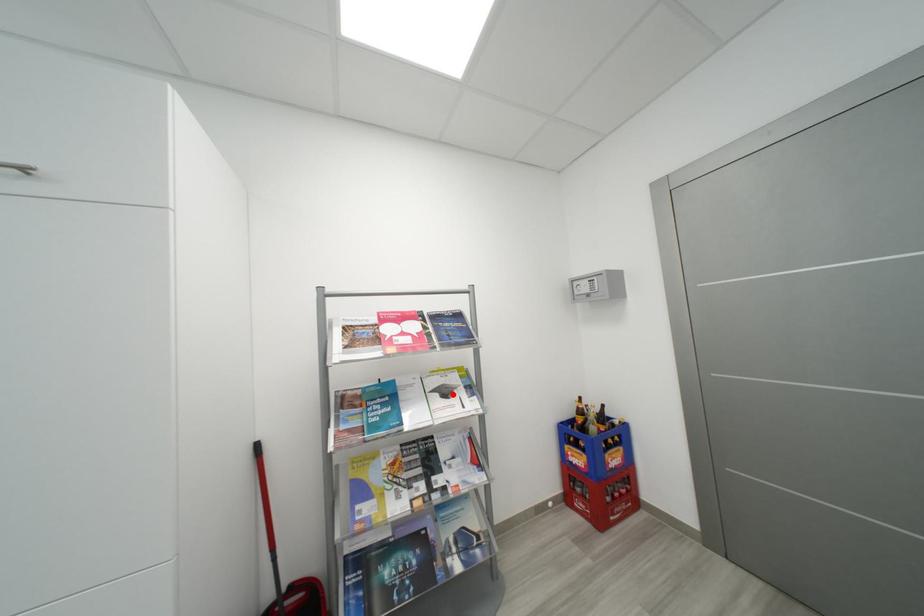
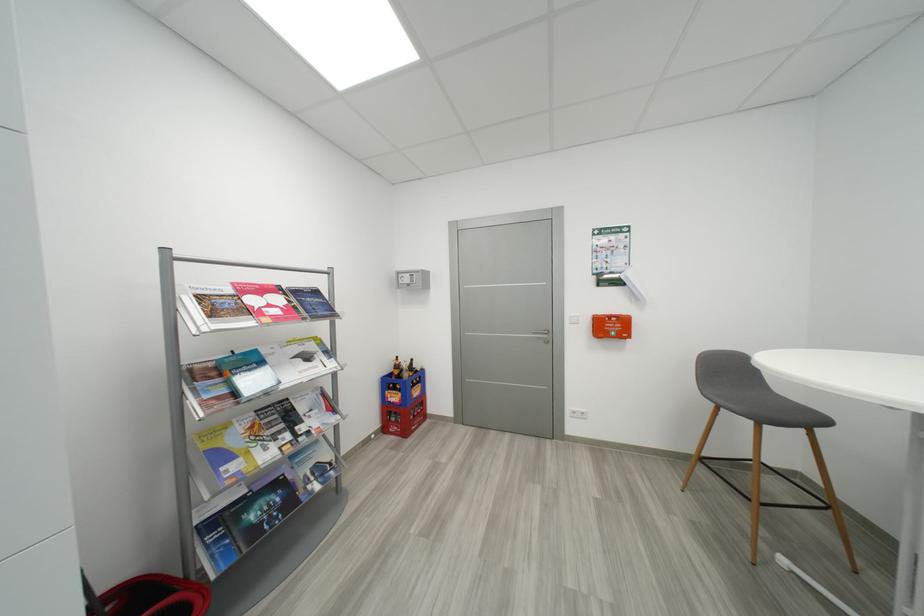
Find the pixel in the second image that matches the highlighted location in the first image.

(314, 359)